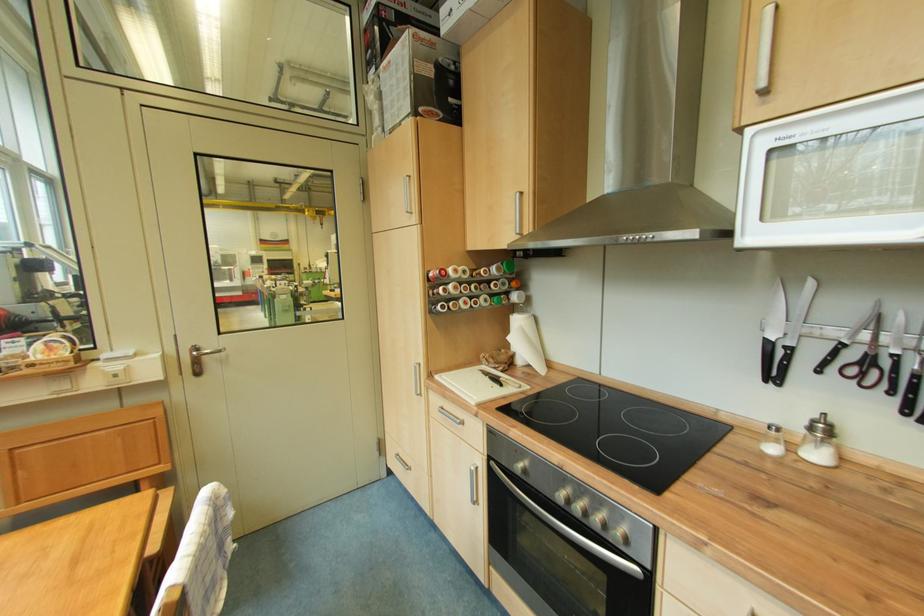
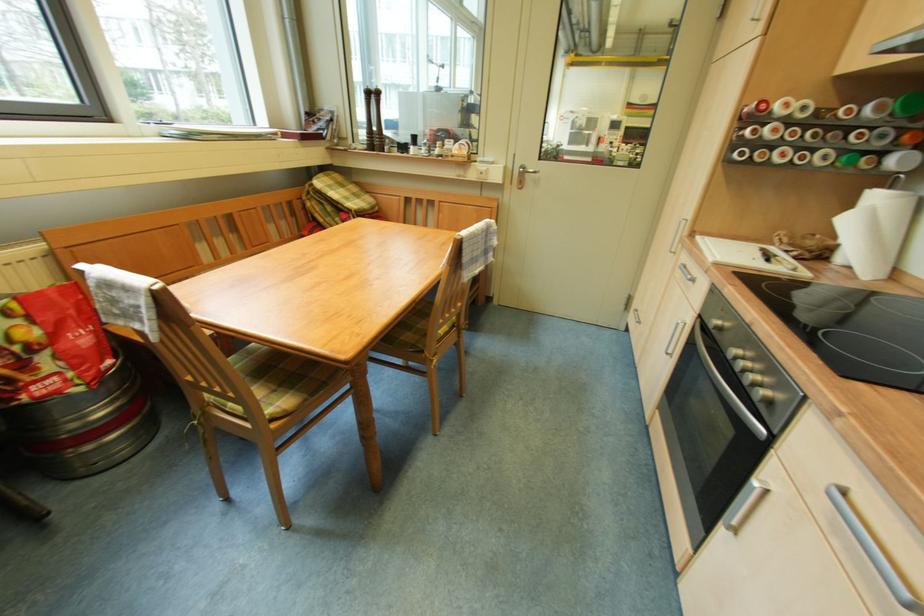
From the picture: The first image is from the beginning of the video and the second image is from the end. How did the camera likely rotate when shooting the video?

The camera rotated toward left-down.